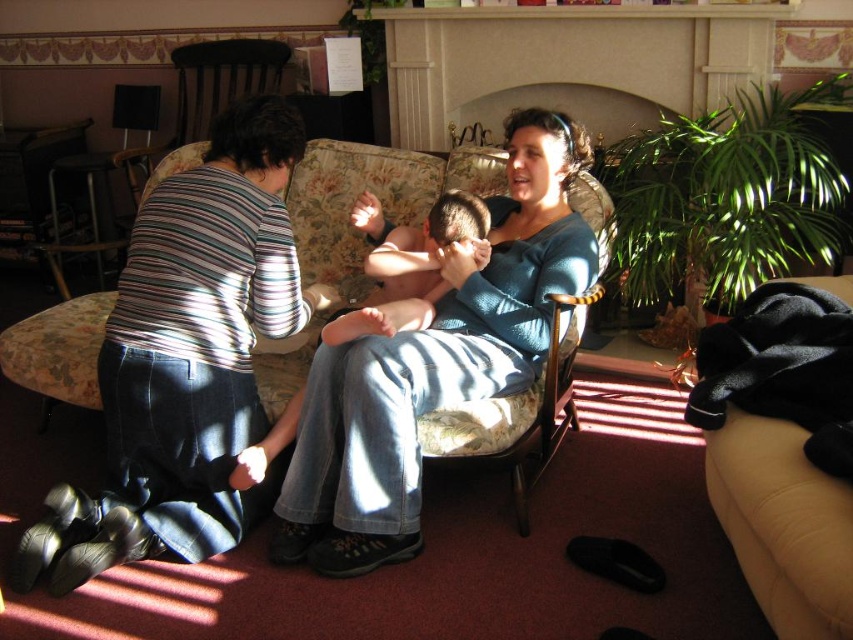
You are a photographer setting up a shoot in this living room. You need to position a small stool that is 1.2 meters tall between the blue denim jeans at center and the smooth skin baby at center. Based on their heights, can the stool be placed so that it doesn

The blue denim jeans at center has a greater height compared to the smooth skin baby at center. Since the stool is 1.2 meters tall, it can be positioned between them as long as the total height difference between the two objects allows for the stool to fit vertically. However, without specific height measurements of the objects themselves, it is difficult to determine exact placement. The description only states the jeans are taller than the baby, but not by how much. Therefore, the photographer should beca

You are standing in the living room and want to find the point at coordinates (x=186, y=360). According to the scene description, where exactly is this point located?

The point at coordinates (x=186, y=360) is located on the dark blue jeans at lower left.

You are organizing a photo shoot and need to ensure that the dark blue jeans at lower left and the blue denim jeans at center are both visible in the frame. Based on their spatial arrangement, which pair of jeans might be partially obscured if the camera is positioned to focus on the other? Please explain your reasoning.

The dark blue jeans at lower left occupies less space than blue denim jeans at center, so if the camera focuses on the blue denim jeans at center, the smaller dark blue jeans at lower left might be partially obscured due to its smaller size and positioning.